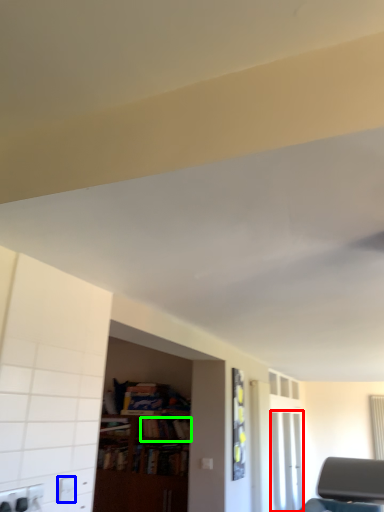
Question: Which object is positioned farthest from glass door (highlighted by a red box)? Select from electric outlet (highlighted by a blue box) and book (highlighted by a green box).

Choices:
 (A) electric outlet
 (B) book

Answer: (A)